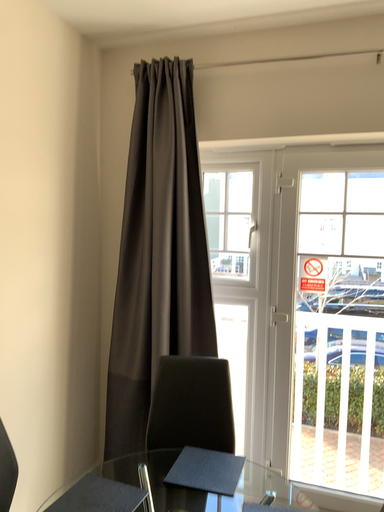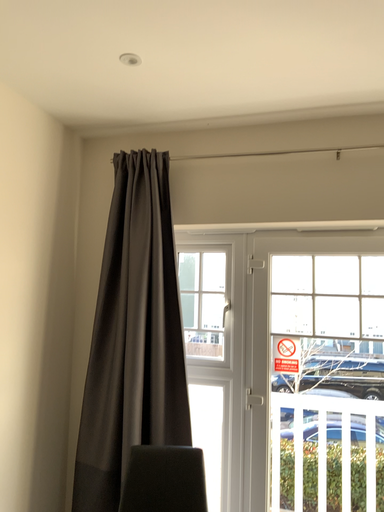
Question: Which way did the camera rotate in the video?

Choices:
 (A) rotated upward
 (B) rotated downward

Answer: (A)